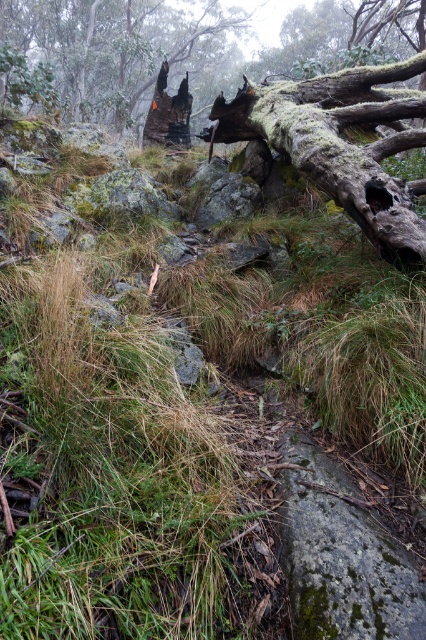
Consider the image. Can you confirm if mossy bark tree trunk at upper center is positioned below charcoal burnt tree stump at upper center?

Indeed, mossy bark tree trunk at upper center is positioned under charcoal burnt tree stump at upper center.

Is mossy bark tree trunk at upper center positioned behind charcoal burnt tree stump at upper center?

No.

Between point (345, 145) and point (98, 112), which one is positioned in front?

Point (345, 145) is in front.

What are the coordinates of `mossy bark tree trunk at upper center` in the screenshot? It's located at (340, 144).